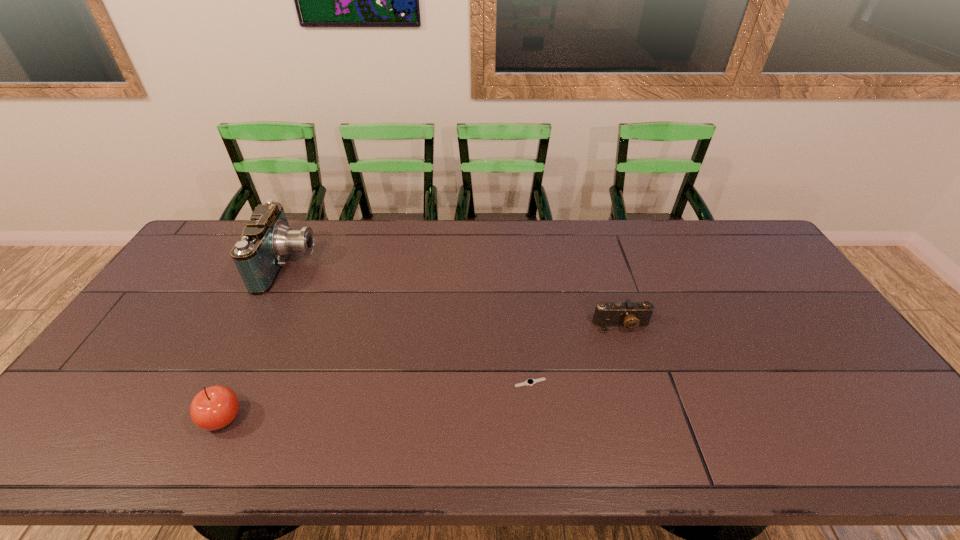
This screenshot has height=540, width=960. I want to click on vacant region between the farthest object and the watch, so click(x=409, y=324).

At what (x,y) coordinates should I click in order to perform the action: click on free area in between the apple and the shortest object. Please return your answer as a coordinate pair (x, y). The height and width of the screenshot is (540, 960). Looking at the image, I should click on (376, 401).

In order to click on vacant space in between the camcorder and the nearest object in this screenshot , I will do `click(255, 341)`.

Image resolution: width=960 pixels, height=540 pixels. What are the coordinates of `free point between the second tallest object and the camcorder` in the screenshot? It's located at (255, 341).

Where is `unoccupied area between the third nearest object and the apple`? unoccupied area between the third nearest object and the apple is located at coordinates [x=422, y=372].

The height and width of the screenshot is (540, 960). Find the location of `vacant area between the camcorder and the rightmost object`. vacant area between the camcorder and the rightmost object is located at coordinates (455, 295).

Locate an element on the screen. The width and height of the screenshot is (960, 540). vacant point located between the shortest object and the tallest object is located at coordinates (409, 324).

The image size is (960, 540). In order to click on free area in between the tallest object and the apple in this screenshot , I will do 255,341.

The image size is (960, 540). What are the coordinates of `object that stands as the second closest to the camcorder` in the screenshot? It's located at (529, 382).

Identify which object is located as the third nearest to the tallest object. Please provide its 2D coordinates. Your answer should be formatted as a tuple, i.e. [(x, y)], where the tuple contains the x and y coordinates of a point satisfying the conditions above.

[(629, 314)]